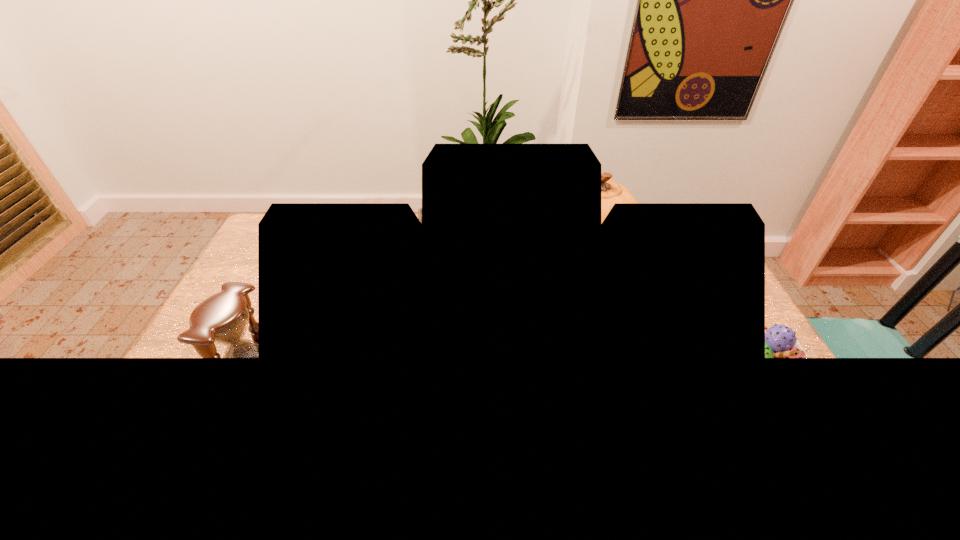
The image size is (960, 540). What are the coordinates of `object that is at the near left corner` in the screenshot? It's located at (222, 318).

Find the location of `object present at the near right corner`. object present at the near right corner is located at coordinates (780, 341).

At what (x,y) coordinates should I click in order to perform the action: click on free space at the far edge of the desktop. Please return your answer as a coordinate pair (x, y). This screenshot has height=540, width=960. Looking at the image, I should click on (365, 244).

Where is `blank area at the near edge`? This screenshot has width=960, height=540. blank area at the near edge is located at coordinates (516, 394).

This screenshot has height=540, width=960. What are the coordinates of `blank space at the left edge of the desktop` in the screenshot? It's located at (261, 268).

What are the coordinates of `free location at the right edge of the desktop` in the screenshot? It's located at (684, 279).

The height and width of the screenshot is (540, 960). In the image, there is a desktop. In order to click on vacant space at the far left corner in this screenshot , I will do `click(301, 234)`.

Identify the location of vacant area that lies between the shortest object and the third object from right to left. [x=597, y=322].

The height and width of the screenshot is (540, 960). Find the location of `unoccupied position between the phonograph_record and the icecream`. unoccupied position between the phonograph_record and the icecream is located at coordinates (597, 322).

Where is `free space between the tallest object and the phonograph_record`? This screenshot has width=960, height=540. free space between the tallest object and the phonograph_record is located at coordinates (513, 258).